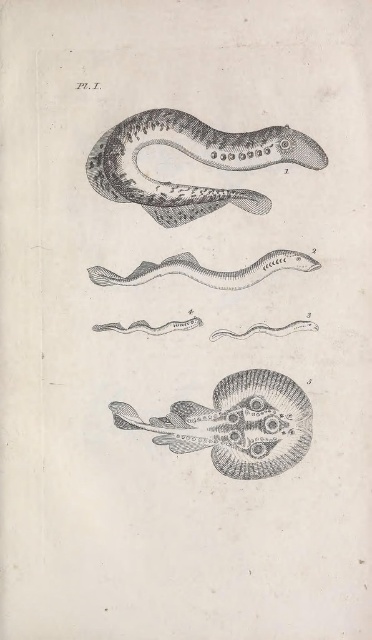
Between etched paper stingray at center and gray line drawing snake at center, which one is positioned lower?

Positioned lower is etched paper stingray at center.

Does etched paper stingray at center have a lesser height compared to gray line drawing snake at center?

No.

Between point (203, 412) and point (107, 272), which one is positioned behind?

The point (203, 412) is behind.

The image size is (372, 640). What are the coordinates of `etched paper stingray at center` in the screenshot? It's located at (235, 424).

Does black line drawing snake at upper center appear under etched paper stingray at center?

Incorrect, black line drawing snake at upper center is not positioned below etched paper stingray at center.

Between black line drawing snake at upper center and etched paper stingray at center, which one appears on the left side from the viewer's perspective?

black line drawing snake at upper center

Is point (309, 148) farther from camera compared to point (303, 435)?

No.

Find the location of a particular element. The height and width of the screenshot is (640, 372). black line drawing snake at upper center is located at coordinates (193, 157).

Which of these two, black line drawing snake at upper center or gray line drawing snake at center, stands taller?

Standing taller between the two is black line drawing snake at upper center.

Is point (139, 132) behind point (190, 275)?

No.

Between point (207, 148) and point (241, 278), which one is positioned behind?

The point (241, 278) is more distant.

Identify the location of black line drawing snake at upper center. (193, 157).